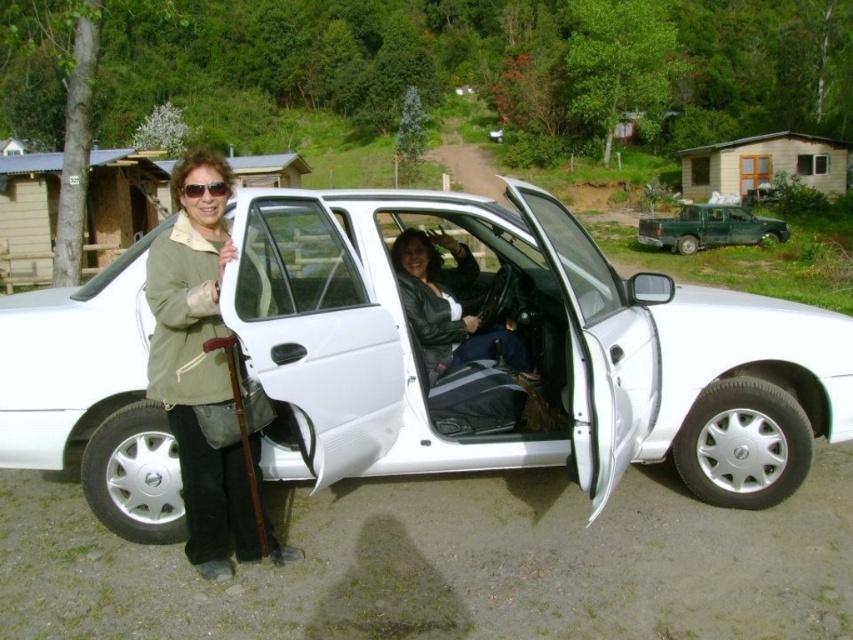
Question: Estimate the real-world distances between objects in this image. Which object is closer to the green matte jacket at left?

Choices:
 (A) sunglasses at left
 (B) white matte car at center
 (C) green matte truck at upper right

Answer: (A)

Question: Does green matte jacket at left have a lesser width compared to sunglasses at left?

Choices:
 (A) yes
 (B) no

Answer: (B)

Question: Does white matte car at center appear on the right side of green matte jacket at left?

Choices:
 (A) no
 (B) yes

Answer: (B)

Question: Can you confirm if white matte car at center is smaller than sunglasses at left?

Choices:
 (A) no
 (B) yes

Answer: (A)

Question: Which of these objects is positioned farthest from the sunglasses at left?

Choices:
 (A) green matte jacket at left
 (B) green matte truck at upper right

Answer: (B)

Question: Which object is positioned closest to the green matte jacket at left?

Choices:
 (A) green matte truck at upper right
 (B) white matte car at center
 (C) sunglasses at left
 (D) leather jacket at center

Answer: (C)